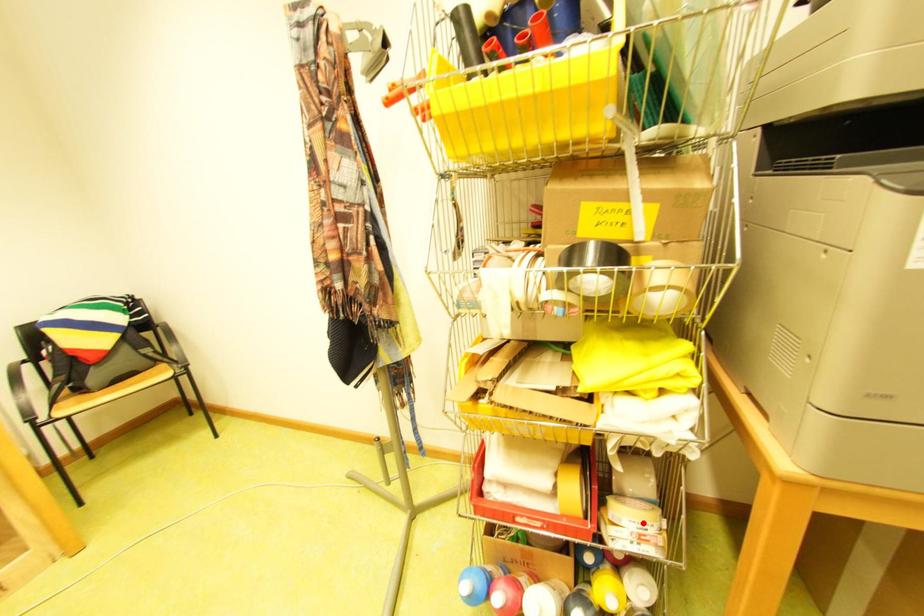
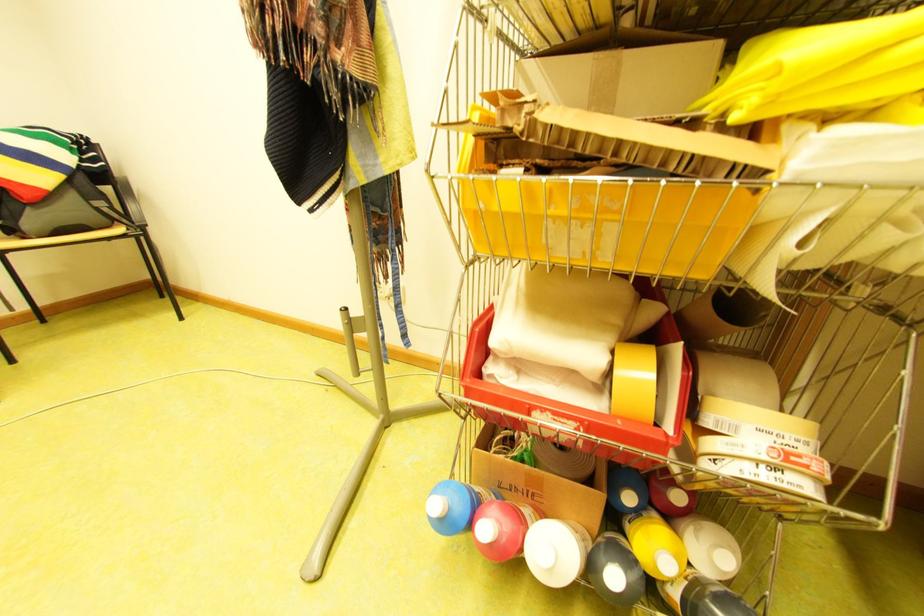
Question: I am providing you with two images of the same scene from different viewpoints. A red point is marked on the first image. At the location where the point appears in image 1, is it still visible in image 2?

Choices:
 (A) Yes
 (B) No

Answer: (A)